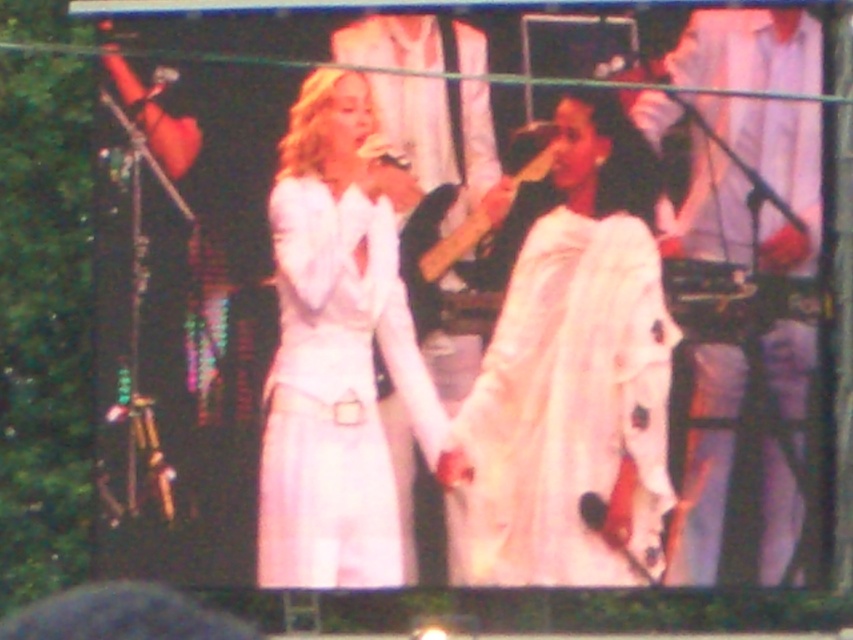
Question: Which point is farther to the camera?

Choices:
 (A) (436, 273)
 (B) (692, 244)
 (C) (344, 145)
 (D) (518, 444)

Answer: (C)

Question: Which object appears closest to the camera in this image?

Choices:
 (A) white satin dress at center
 (B) white textured dress at center

Answer: (B)

Question: Which point is farther to the camera?

Choices:
 (A) (524, 179)
 (B) (405, 195)

Answer: (B)

Question: Is white textured dress at center to the right of wooden guitar at center from the viewer's perspective?

Choices:
 (A) yes
 (B) no

Answer: (A)

Question: Does white cotton shirt at right have a greater width compared to wooden guitar at center?

Choices:
 (A) no
 (B) yes

Answer: (B)

Question: Is white textured dress at center closer to the viewer compared to wooden guitar at center?

Choices:
 (A) no
 (B) yes

Answer: (B)